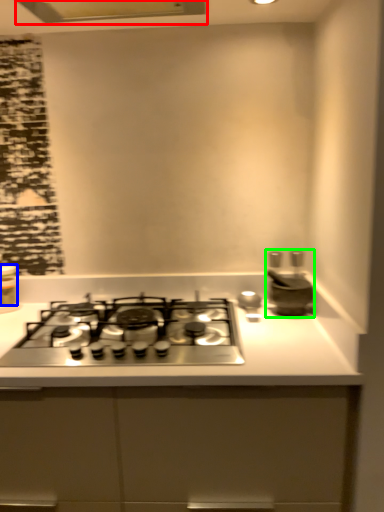
Question: Which is nearer to the exhaust hood (highlighted by a red box)? kitchen appliance (highlighted by a blue box) or appliance (highlighted by a green box).

Choices:
 (A) kitchen appliance
 (B) appliance

Answer: (A)